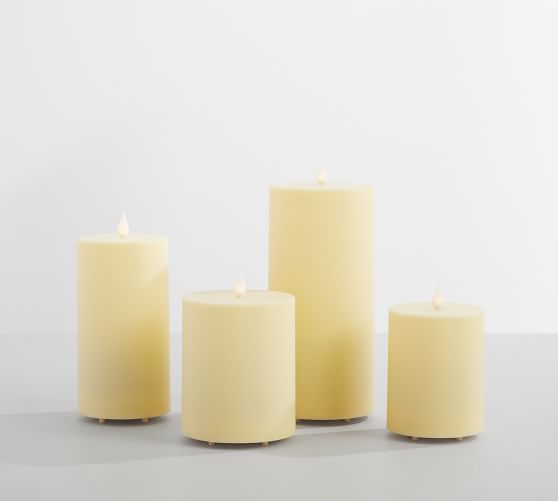
Where is `candles`? candles is located at coordinates (141, 292), (334, 290), (238, 365), (435, 350).